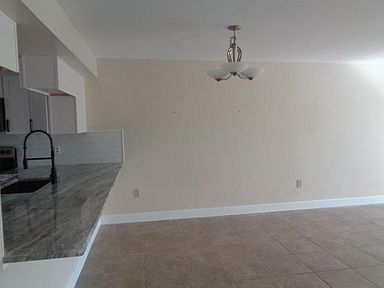
Image resolution: width=384 pixels, height=288 pixels. What are the coordinates of `cabinet` in the screenshot? It's located at (26, 106).